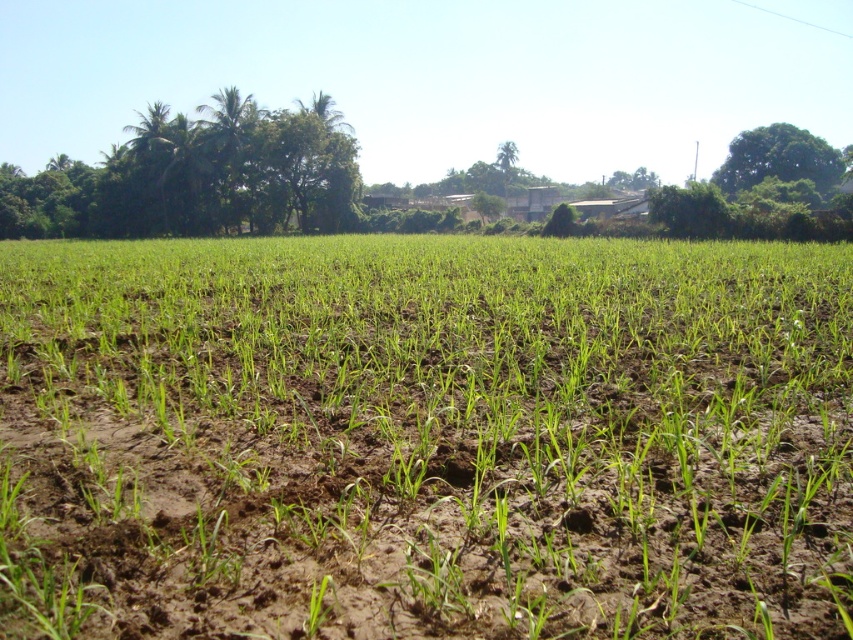
Question: Observing the image, what is the correct spatial positioning of green leafy trees at upper left in reference to green leafy tree at upper right?

Choices:
 (A) above
 (B) below

Answer: (A)

Question: Can you confirm if green grassy field at center is smaller than green leafy trees at upper left?

Choices:
 (A) yes
 (B) no

Answer: (A)

Question: Does green grassy field at center appear under green leafy trees at upper left?

Choices:
 (A) no
 (B) yes

Answer: (B)

Question: Among these objects, which one is farthest from the camera?

Choices:
 (A) green grassy field at center
 (B) green leafy tree at upper right
 (C) green leafy tree at upper center

Answer: (C)

Question: Which object appears farthest from the camera in this image?

Choices:
 (A) green leafy tree at upper right
 (B) green grassy field at center
 (C) green leafy trees at upper left
 (D) green leafy tree at upper center

Answer: (D)

Question: Considering the real-world distances, which object is farthest from the green leafy trees at upper left?

Choices:
 (A) green leafy tree at upper right
 (B) green grassy field at center

Answer: (A)